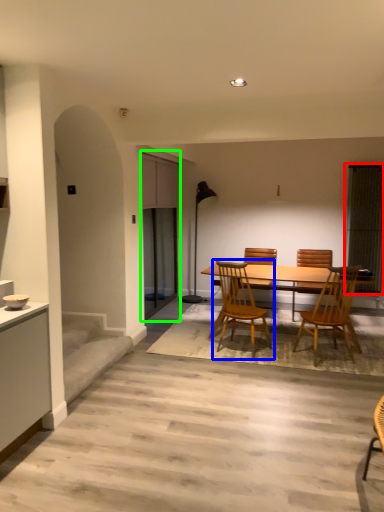
Question: Estimate the real-world distances between objects in this image. Which object is closer to window screen (highlighted by a red box), chair (highlighted by a blue box) or screen door (highlighted by a green box)?

Choices:
 (A) chair
 (B) screen door

Answer: (A)